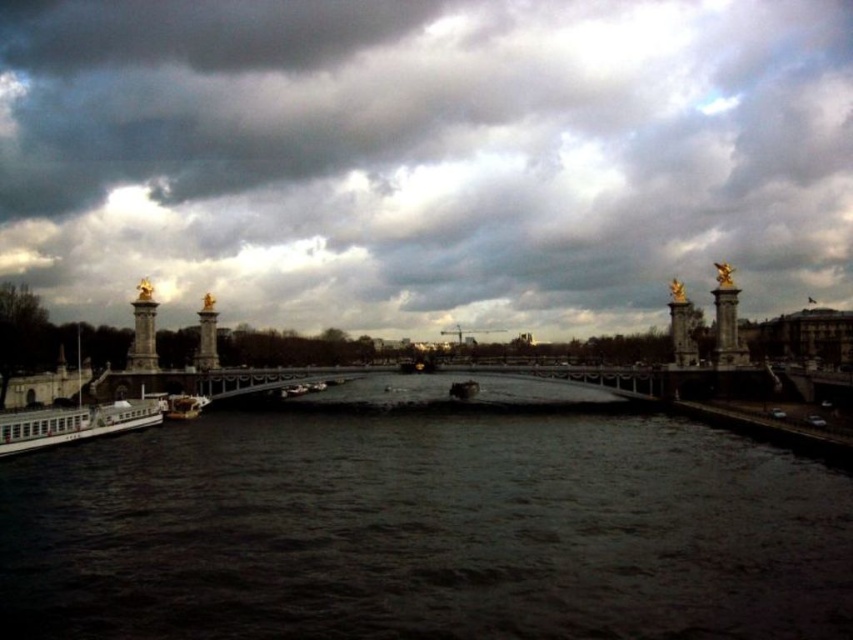
Question: Which of the following is the farthest from the observer?

Choices:
 (A) (94, 385)
 (B) (67, 422)

Answer: (A)

Question: Which object is farther from the camera taking this photo?

Choices:
 (A) dark water at center
 (B) white glossy boat at lower left
 (C) metallic bridge at center
 (D) white matte boat at lower left

Answer: (C)

Question: Which point is farther from the camera taking this photo?

Choices:
 (A) (416, 636)
 (B) (193, 410)
 (C) (323, 141)

Answer: (C)

Question: Is dark water at center wider than shiny metallic boat at center?

Choices:
 (A) no
 (B) yes

Answer: (B)

Question: Does white matte boat at lower left have a larger size compared to shiny metallic boat at center?

Choices:
 (A) no
 (B) yes

Answer: (B)

Question: Observing the image, what is the correct spatial positioning of dark gray cloud at upper center in reference to metallic silver boat at center?

Choices:
 (A) right
 (B) left

Answer: (A)